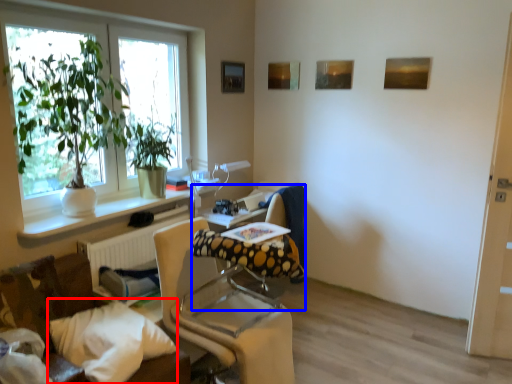
Question: Which object is further to the camera taking this photo, pillow (highlighted by a red box) or swivel chair (highlighted by a blue box)?

Choices:
 (A) pillow
 (B) swivel chair

Answer: (B)